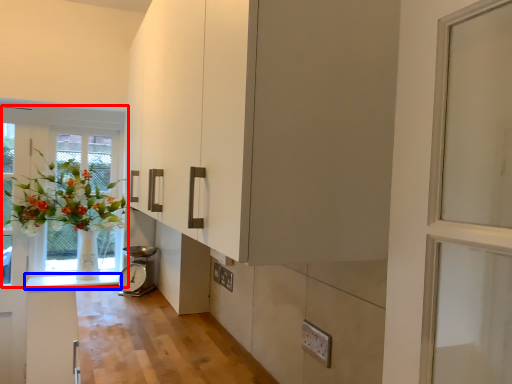
Question: Which point is further to the camera, window (highlighted by a red box) or counter top (highlighted by a blue box)?

Choices:
 (A) window
 (B) counter top

Answer: (B)